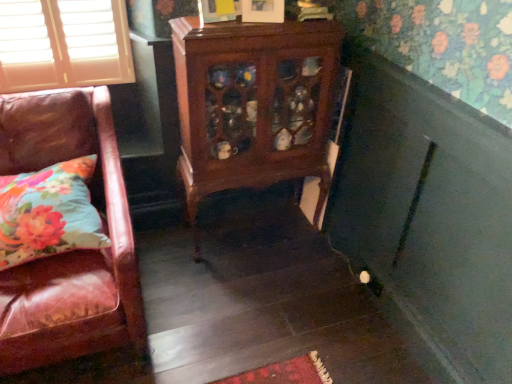
This screenshot has height=384, width=512. Find the location of `mahogany cabinet at center`. mahogany cabinet at center is located at coordinates (253, 105).

What do you see at coordinates (253, 105) in the screenshot? I see `mahogany cabinet at center` at bounding box center [253, 105].

The height and width of the screenshot is (384, 512). What do you see at coordinates (49, 213) in the screenshot? I see `floral fabric pillow at lower left` at bounding box center [49, 213].

Locate an element on the screen. This screenshot has width=512, height=384. floral fabric pillow at lower left is located at coordinates (49, 213).

What is the approximate height of floral fabric pillow at lower left?

The height of floral fabric pillow at lower left is 7.90 inches.

I want to click on mahogany cabinet at center, so click(253, 105).

Between mahogany cabinet at center and floral fabric pillow at lower left, which one appears on the left side from the viewer's perspective?

floral fabric pillow at lower left is more to the left.

Is mahogany cabinet at center further to camera compared to floral fabric pillow at lower left?

Yes, mahogany cabinet at center is further from the camera.

Is point (317, 119) positioned after point (24, 262)?

Yes, it is behind point (24, 262).

From the image's perspective, is mahogany cabinet at center located above floral fabric pillow at lower left?

Yes, from the image's perspective, mahogany cabinet at center is over floral fabric pillow at lower left.

From a real-world perspective, between mahogany cabinet at center and floral fabric pillow at lower left, who is vertically higher?

In real-world perspective, floral fabric pillow at lower left is above.

From the picture: Does mahogany cabinet at center have a greater width compared to floral fabric pillow at lower left?

No, mahogany cabinet at center is not wider than floral fabric pillow at lower left.

Which of these two, mahogany cabinet at center or floral fabric pillow at lower left, stands shorter?

floral fabric pillow at lower left is shorter.

Does mahogany cabinet at center have a smaller size compared to floral fabric pillow at lower left?

Incorrect, mahogany cabinet at center is not smaller in size than floral fabric pillow at lower left.

Does mahogany cabinet at center contain floral fabric pillow at lower left?

Definitely not — floral fabric pillow at lower left is not inside mahogany cabinet at center.

Are mahogany cabinet at center and floral fabric pillow at lower left making contact?

mahogany cabinet at center and floral fabric pillow at lower left are clearly separated.

Is mahogany cabinet at center oriented away from floral fabric pillow at lower left?

No.

This screenshot has width=512, height=384. I want to click on furniture above the floral fabric pillow at lower left (from the image's perspective), so click(253, 105).

Would you say floral fabric pillow at lower left is to the left or to the right of mahogany cabinet at center in the picture?

From the image, it's evident that floral fabric pillow at lower left is to the left of mahogany cabinet at center.

Is floral fabric pillow at lower left positioned behind mahogany cabinet at center?

No, floral fabric pillow at lower left is in front of mahogany cabinet at center.

Does point (20, 178) lie behind point (228, 57)?

No, (20, 178) is in front of (228, 57).

From the image's perspective, does floral fabric pillow at lower left appear lower than mahogany cabinet at center?

Yes, from the image's perspective, floral fabric pillow at lower left is below mahogany cabinet at center.

From a real-world perspective, which object rests below the other?

mahogany cabinet at center.

Does floral fabric pillow at lower left have a greater width compared to mahogany cabinet at center?

Indeed, floral fabric pillow at lower left has a greater width compared to mahogany cabinet at center.

Between floral fabric pillow at lower left and mahogany cabinet at center, which one has less height?

Standing shorter between the two is floral fabric pillow at lower left.

Who is bigger, floral fabric pillow at lower left or mahogany cabinet at center?

With larger size is mahogany cabinet at center.

Is floral fabric pillow at lower left not inside mahogany cabinet at center?

Indeed, floral fabric pillow at lower left is completely outside mahogany cabinet at center.

Are floral fabric pillow at lower left and mahogany cabinet at center beside each other?

No, floral fabric pillow at lower left is not with mahogany cabinet at center.

Is mahogany cabinet at center at the back of floral fabric pillow at lower left?

That's not correct — floral fabric pillow at lower left is not looking away from mahogany cabinet at center.

Measure the distance between floral fabric pillow at lower left and mahogany cabinet at center.

The distance of floral fabric pillow at lower left from mahogany cabinet at center is 70.58 centimeters.

Locate an element on the screen. This screenshot has width=512, height=384. pillow above the mahogany cabinet at center (from a real-world perspective) is located at coordinates (49, 213).

The width and height of the screenshot is (512, 384). Identify the location of pillow in front of the mahogany cabinet at center. (49, 213).

Locate an element on the screen. furniture that appears above the floral fabric pillow at lower left (from the image's perspective) is located at coordinates (253, 105).